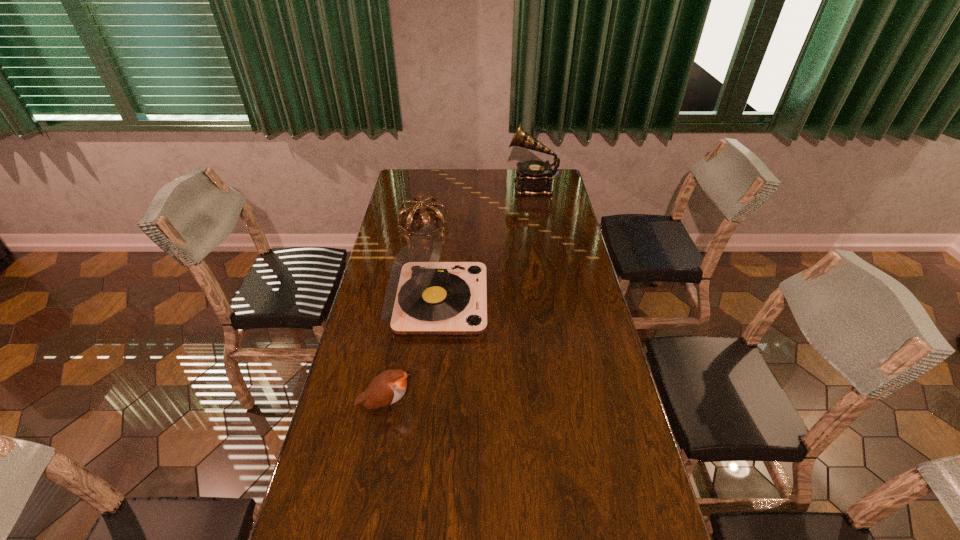
The width and height of the screenshot is (960, 540). In the image, there is a desktop. Identify the location of free space at the far left corner. (403, 171).

Identify the location of vacant area that lies between the second nearest object and the bird. (412, 353).

You are a GUI agent. You are given a task and a screenshot of the screen. Output one action in this format:
    pyautogui.click(x=<x>, y=<y>)
    Task: Click on the empty space between the record player and the farthest object
    Image resolution: width=960 pixels, height=540 pixels.
    Given the screenshot: What is the action you would take?
    pyautogui.click(x=485, y=244)

The image size is (960, 540). I want to click on free space between the farthest object and the record player, so (485, 244).

This screenshot has height=540, width=960. Identify the location of unoccupied position between the farthest object and the record player. (485, 244).

Where is `vacant space that's between the second nearest object and the rightmost object`? The image size is (960, 540). vacant space that's between the second nearest object and the rightmost object is located at coordinates (485, 244).

The width and height of the screenshot is (960, 540). Find the location of `the second closest object to the record player`. the second closest object to the record player is located at coordinates (417, 205).

Locate which object is the second closest to the tiara. Please provide its 2D coordinates. Your answer should be formatted as a tuple, i.e. [(x, y)], where the tuple contains the x and y coordinates of a point satisfying the conditions above.

[(534, 178)]

Identify the location of vacant space that satisfies the following two spatial constraints: 1. on the front side of the second farthest object; 2. at the face of the nearest object. (393, 404).